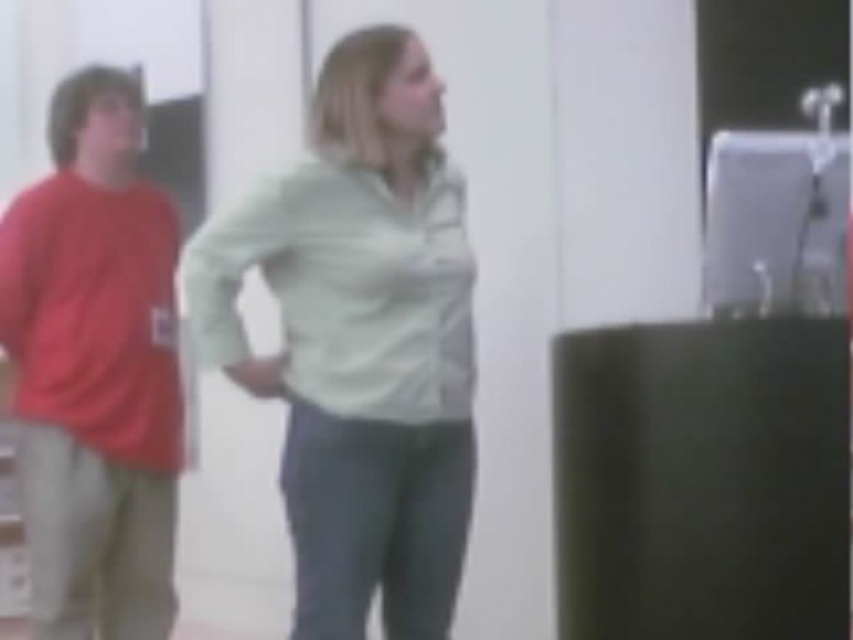
Question: Which point is closer to the camera?

Choices:
 (A) (351, 72)
 (B) (93, 627)
 (C) (445, 244)

Answer: (A)

Question: Which point is farther from the camera taking this photo?

Choices:
 (A) (18, 362)
 (B) (360, 115)
 (C) (184, 314)

Answer: (A)

Question: Can you confirm if matte red shirt at left is thinner than light green cotton shirt at center?

Choices:
 (A) no
 (B) yes

Answer: (B)

Question: Does light green fabric shirt at center come in front of matte red shirt at left?

Choices:
 (A) yes
 (B) no

Answer: (A)

Question: Does matte red shirt at left appear over light green cotton shirt at center?

Choices:
 (A) yes
 (B) no

Answer: (B)

Question: Estimate the real-world distances between objects in this image. Which object is farther from the light green cotton shirt at center?

Choices:
 (A) matte red shirt at left
 (B) light green fabric shirt at center

Answer: (A)